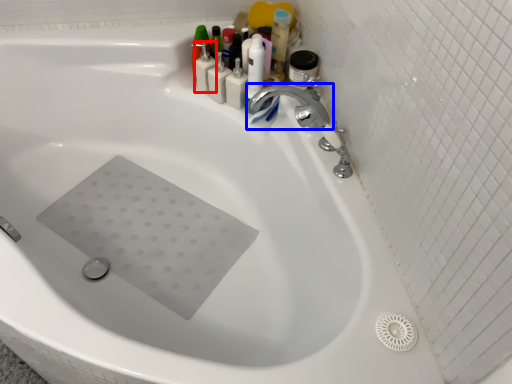
Question: Which point is closer to the camera, toiletry (highlighted by a red box) or tap (highlighted by a blue box)?

Choices:
 (A) toiletry
 (B) tap

Answer: (B)